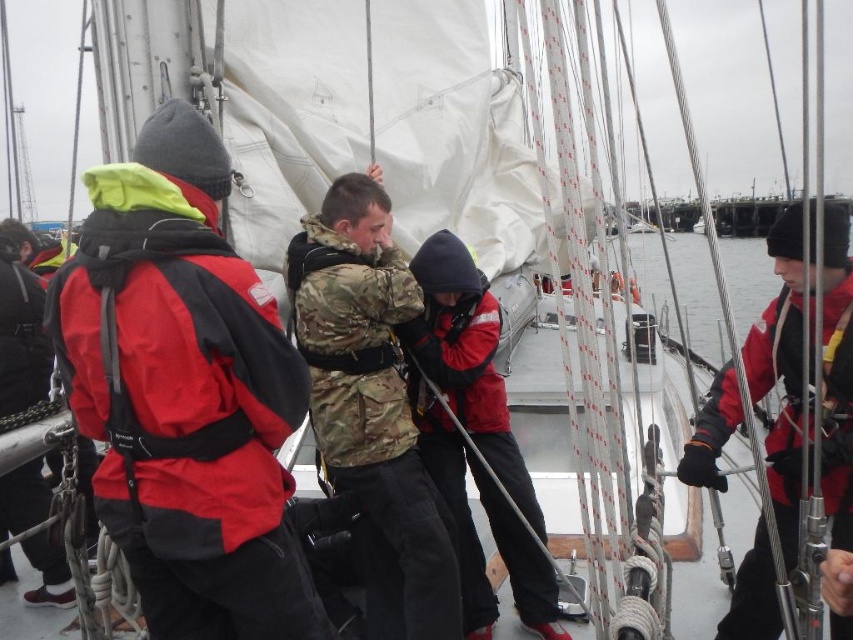
You are standing on the deck of the sailboat and need to hand a rope to both the person wearing the red matte jacket at left and the person wearing the camo fabric jacket at center. Which jacket wearer should you approach first based on their proximity to you?

You should approach the person wearing the red matte jacket at left first because they are closer to you than the camo fabric jacket at center.

Looking at this image, you are on a sailboat and need to hand a life preserver to the person wearing the red matte jacket at left and the red matte jacket at right. Which jacket is closer to you so you can reach them first?

The red matte jacket at left is closer to the viewer than the red matte jacket at right, so you can reach them first by handing the life preserver to the person wearing the red matte jacket at left.

You are a photographer trying to capture a clear shot of both the red matte jacket at left and the red matte jacket at right. Since you want to ensure both are visible in your frame, which jacket is closer to the camera, and which is farther away?

The red matte jacket at left is positioned over the red matte jacket at right, meaning the jacket on the left is closer to the camera while the one on the right is farther away.